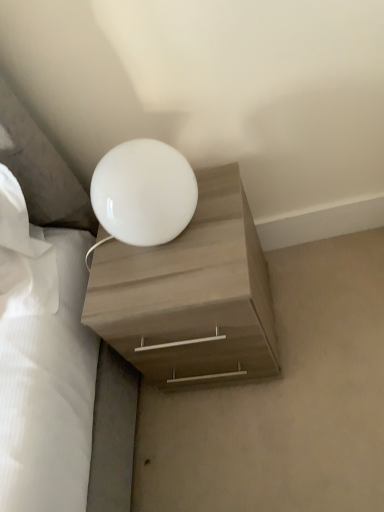
I want to click on vacant region in front of matte wood nightstand at center, so click(271, 436).